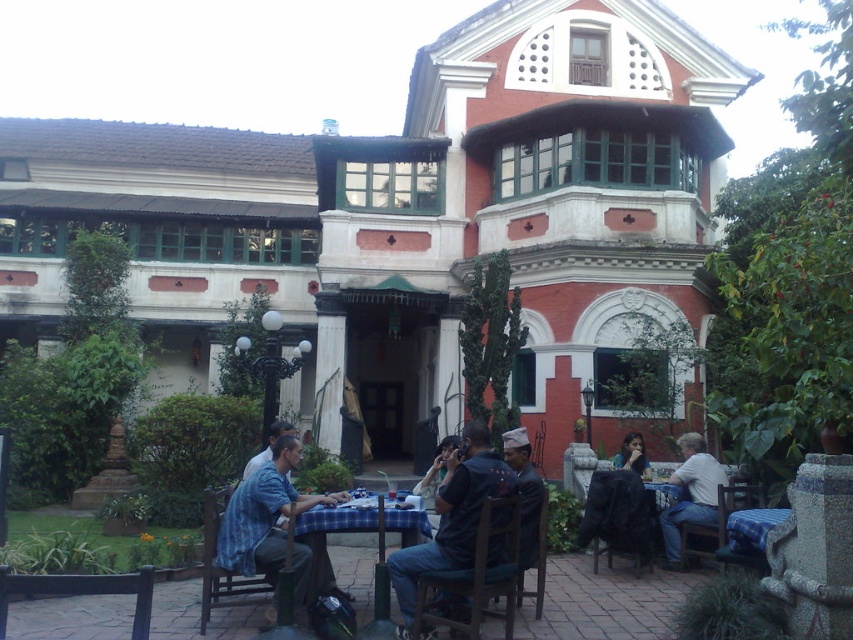
You are a guest at a garden event and want to place a rectangular gift box on the table. The box is as wide as the matte black shirt at center. Will it fit on the blue plaid tablecloth at center?

The blue plaid tablecloth at center has a lesser width compared to matte black shirt at center. Since the gift box is as wide as the matte black shirt at center, it will be wider than the tablecloth. Therefore, the gift box will not fit on the blue plaid tablecloth at center.

You are standing at the entrance of the courtyard and want to locate the person wearing the dark blue shirt at center. According to the coordinates provided, in which direction relative to the entrance should you look to find them?

The dark blue shirt at center is located at coordinates point (x=451, y=516), which means it is positioned towards the upper right direction from the entrance.

You are a photographer standing in the courtyard and want to take a photo of the two people wearing the blue striped shirt at lower left and the blue denim shirt at lower left. Which one should you focus on first to ensure both are in sharp focus?

You should focus on the blue striped shirt at lower left first because it is closer to the viewer than the blue denim shirt at lower left, so adjusting focus from near to far will help both be in focus.